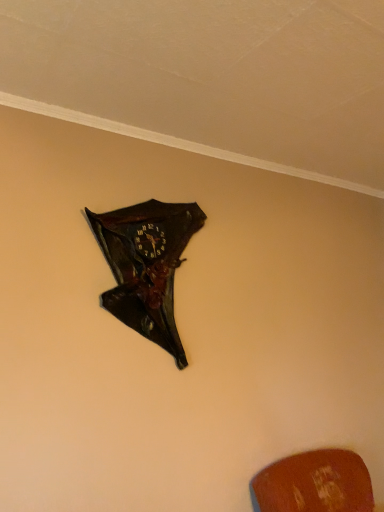
Image resolution: width=384 pixels, height=512 pixels. Find the location of `dark brown leather wall clock at upper center`. dark brown leather wall clock at upper center is located at coordinates (147, 265).

Measure the distance between dark brown leather wall clock at upper center and camera.

A distance of 5.35 feet exists between dark brown leather wall clock at upper center and camera.

What do you see at coordinates (147, 265) in the screenshot?
I see `dark brown leather wall clock at upper center` at bounding box center [147, 265].

The width and height of the screenshot is (384, 512). In order to click on dark brown leather wall clock at upper center in this screenshot , I will do `click(147, 265)`.